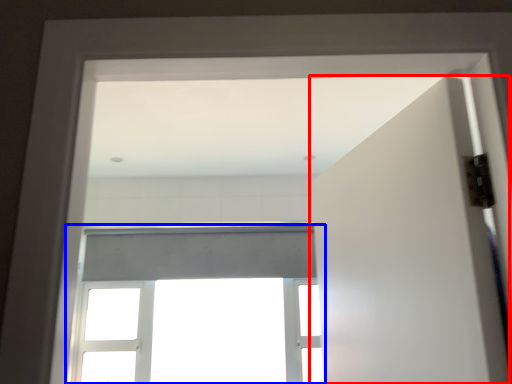
Question: Which object appears closest to the camera in this image, door (highlighted by a red box) or window (highlighted by a blue box)?

Choices:
 (A) door
 (B) window

Answer: (A)